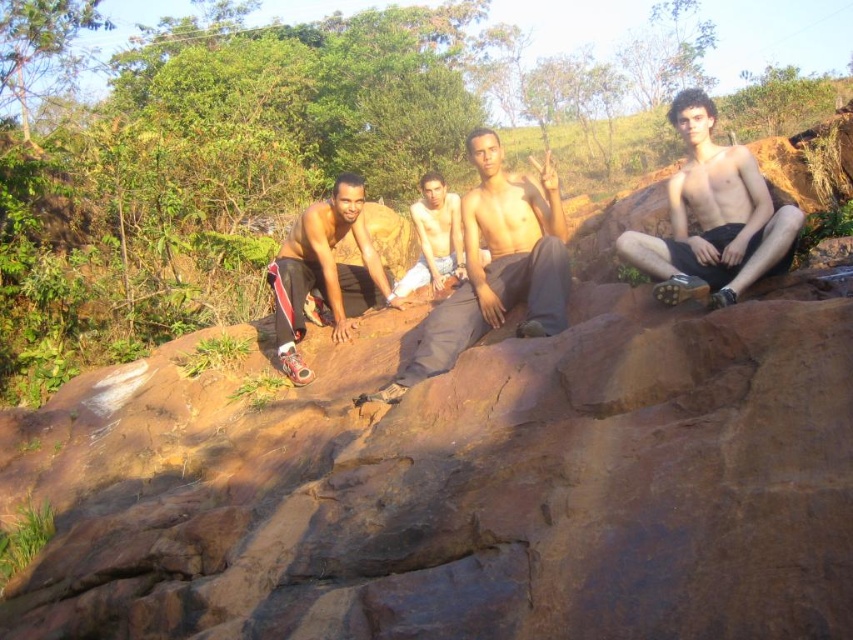
Question: Which object is positioned closest to the shiny black shorts at right?

Choices:
 (A) shiny black shorts at left
 (B) brown rough rock at center
 (C) shiny skin at center

Answer: (C)

Question: Is brown rough rock at center closer to camera compared to shiny black shorts at right?

Choices:
 (A) yes
 (B) no

Answer: (A)

Question: Does brown rough rock at center have a smaller size compared to shiny black shorts at left?

Choices:
 (A) yes
 (B) no

Answer: (B)

Question: Estimate the real-world distances between objects in this image. Which object is farther from the shiny black shorts at right?

Choices:
 (A) shiny black shorts at left
 (B) shiny skin at center
 (C) brown rough rock at center

Answer: (C)

Question: Which of the following is the farthest from the observer?

Choices:
 (A) shiny black shorts at right
 (B) shiny skin at center
 (C) shiny black shorts at left
 (D) brown rough rock at center

Answer: (C)

Question: From the image, what is the correct spatial relationship of brown rough rock at center in relation to shiny black shorts at left?

Choices:
 (A) below
 (B) above

Answer: (A)